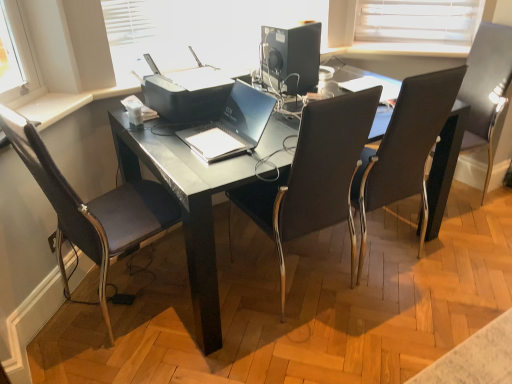
At what (x,y) coordinates should I click in order to perform the action: click on vacant area that is in front of black leather chair at center, which is the third chair in right-to-left order. Please return your answer as a coordinate pair (x, y). Image resolution: width=512 pixels, height=384 pixels. Looking at the image, I should click on (298, 343).